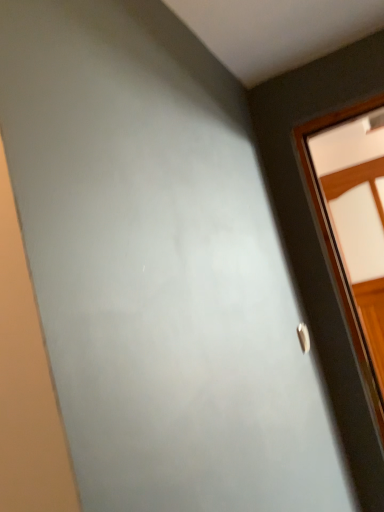
What is the approximate width of silver metallic door handle at right?

The width of silver metallic door handle at right is 0.87 inches.

This screenshot has width=384, height=512. Describe the element at coordinates (303, 337) in the screenshot. I see `silver metallic door handle at right` at that location.

Locate an element on the screen. Image resolution: width=384 pixels, height=512 pixels. silver metallic door handle at right is located at coordinates (303, 337).

Describe the element at coordinates (352, 219) in the screenshot. I see `wooden window at right` at that location.

At what (x,y) coordinates should I click in order to perform the action: click on wooden window at right. Please return your answer as a coordinate pair (x, y). This screenshot has width=384, height=512. Looking at the image, I should click on (352, 219).

Where is `silver metallic door handle at right`? This screenshot has width=384, height=512. silver metallic door handle at right is located at coordinates (303, 337).

Considering the relative positions of silver metallic door handle at right and wooden window at right in the image provided, is silver metallic door handle at right to the right of wooden window at right from the viewer's perspective?

No, silver metallic door handle at right is not to the right of wooden window at right.

Which object is closer to the camera taking this photo, silver metallic door handle at right or wooden window at right?

Positioned in front is silver metallic door handle at right.

Is point (298, 333) more distant than point (357, 203)?

No.

From the image's perspective, which one is positioned lower, silver metallic door handle at right or wooden window at right?

silver metallic door handle at right, from the image's perspective.

From a real-world perspective, who is located higher, silver metallic door handle at right or wooden window at right?

In real-world perspective, wooden window at right is above.

Does silver metallic door handle at right have a lesser width compared to wooden window at right?

Yes, silver metallic door handle at right is thinner than wooden window at right.

Does silver metallic door handle at right have a greater height compared to wooden window at right?

No, silver metallic door handle at right is not taller than wooden window at right.

Can you confirm if silver metallic door handle at right is bigger than wooden window at right?

Incorrect, silver metallic door handle at right is not larger than wooden window at right.

Could wooden window at right be considered to be inside silver metallic door handle at right?

No, wooden window at right is not surrounded by silver metallic door handle at right.

From the picture: Is silver metallic door handle at right far from wooden window at right?

They are positioned close to each other.

In the scene shown: Is silver metallic door handle at right looking in the opposite direction of wooden window at right?

That's not correct — silver metallic door handle at right is not looking away from wooden window at right.

How far apart are silver metallic door handle at right and wooden window at right?

A distance of 36.57 inches exists between silver metallic door handle at right and wooden window at right.

This screenshot has height=512, width=384. I want to click on window above the silver metallic door handle at right (from the image's perspective), so click(x=352, y=219).

Which object is positioned more to the right, wooden window at right or silver metallic door handle at right?

From the viewer's perspective, wooden window at right appears more on the right side.

Is wooden window at right further to camera compared to silver metallic door handle at right?

Yes, wooden window at right is further from the viewer.

Which point is more forward, (365, 347) or (301, 348)?

Point (301, 348)

From the image's perspective, is wooden window at right located beneath silver metallic door handle at right?

No, from the image's perspective, wooden window at right is not below silver metallic door handle at right.

From a real-world perspective, between wooden window at right and silver metallic door handle at right, who is vertically lower?

In real-world perspective, silver metallic door handle at right is lower.

In terms of width, does wooden window at right look wider or thinner when compared to silver metallic door handle at right?

In the image, wooden window at right appears to be wider than silver metallic door handle at right.

Consider the image. Who is taller, wooden window at right or silver metallic door handle at right?

wooden window at right.

Considering the relative sizes of wooden window at right and silver metallic door handle at right in the image provided, is wooden window at right smaller than silver metallic door handle at right?

No, wooden window at right is not smaller than silver metallic door handle at right.

From the picture: Is wooden window at right inside or outside of silver metallic door handle at right?

wooden window at right is not enclosed by silver metallic door handle at right.

Is wooden window at right with silver metallic door handle at right?

They are not placed beside each other.

Is wooden window at right facing away from silver metallic door handle at right?

No, wooden window at right is not facing away from silver metallic door handle at right.

How distant is wooden window at right from silver metallic door handle at right?

They are 36.57 inches apart.

You are a GUI agent. You are given a task and a screenshot of the screen. Output one action in this format:
    pyautogui.click(x=<x>, y=<y>)
    Task: Click on the door handle lying in front of the wooden window at right
    Image resolution: width=384 pixels, height=512 pixels.
    Given the screenshot: What is the action you would take?
    pyautogui.click(x=303, y=337)

Find the location of a particular element. window that appears above the silver metallic door handle at right (from the image's perspective) is located at coordinates (352, 219).

You are a GUI agent. You are given a task and a screenshot of the screen. Output one action in this format:
    pyautogui.click(x=<x>, y=<y>)
    Task: Click on the window positioned vertically above the silver metallic door handle at right (from a real-world perspective)
    
    Given the screenshot: What is the action you would take?
    pyautogui.click(x=352, y=219)